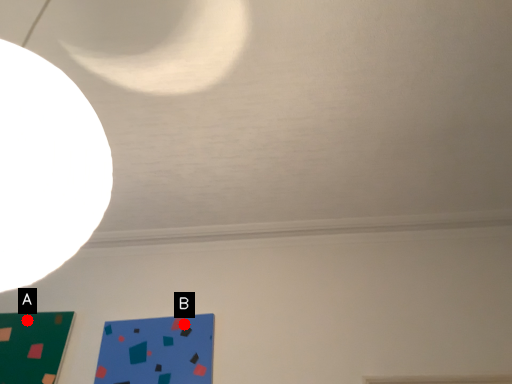
Question: Two points are circled on the image, labeled by A and B beside each circle. Which point is closer to the camera?

Choices:
 (A) A is closer
 (B) B is closer

Answer: (B)